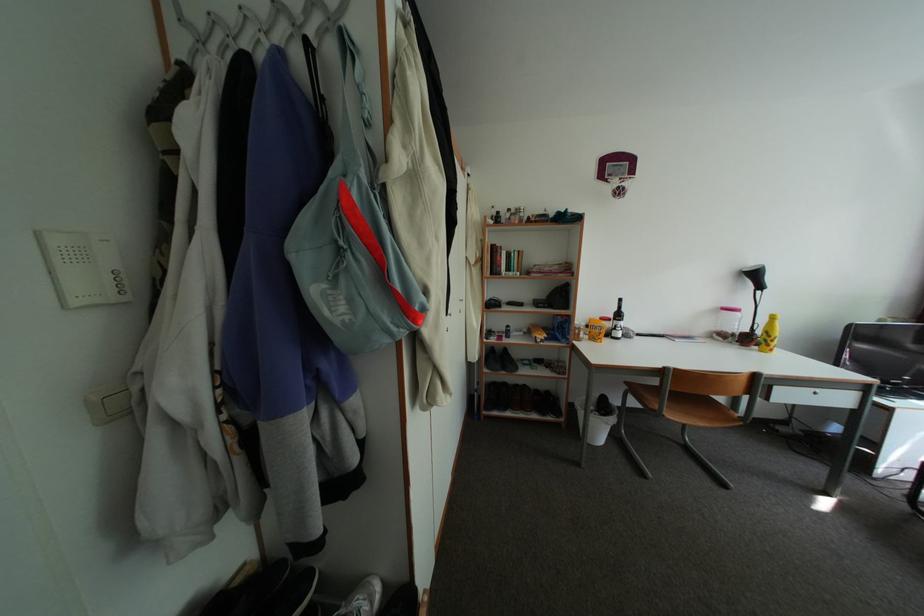
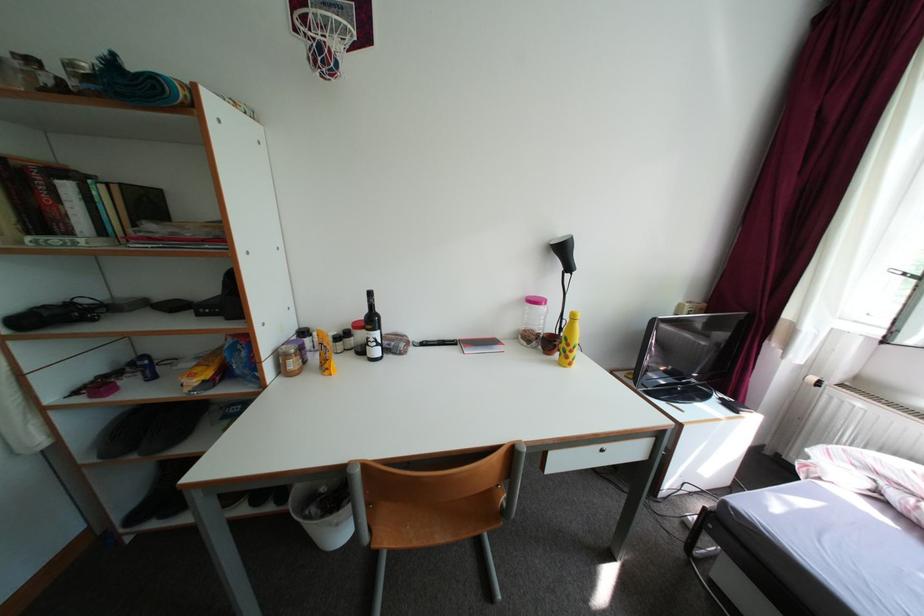
Which direction would the cameraman need to move to produce the second image?

The cameraman moved toward right, forward.